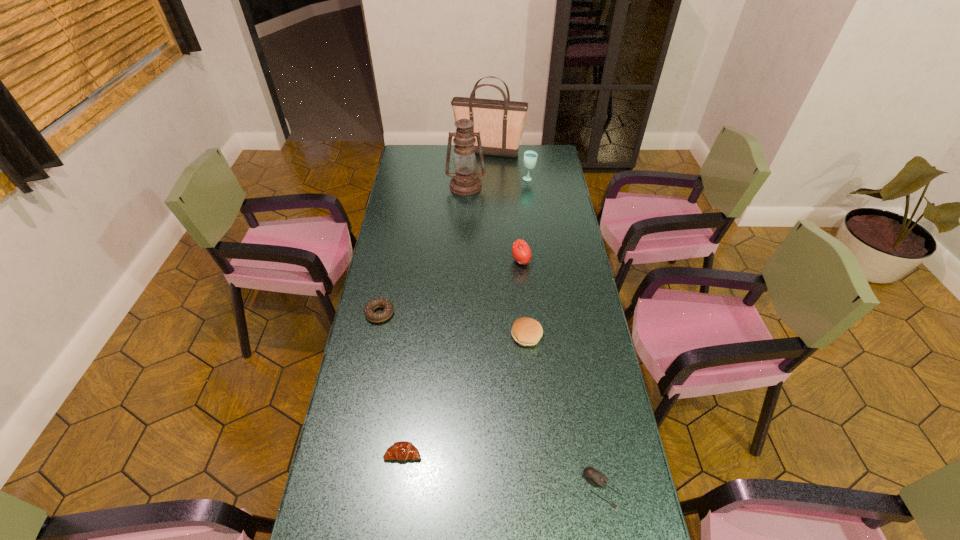
Identify the location of vacant space located on the left of the farthest object. Image resolution: width=960 pixels, height=540 pixels. (427, 152).

I want to click on free space located 0.210m on the left of the oil lamp, so click(403, 186).

I want to click on vacant position located 0.390m on the left of the glass, so click(x=444, y=179).

Find the location of a particular element. This screenshot has width=960, height=540. vacant position located 0.340m on the back of the fourth tallest object is located at coordinates (516, 203).

You are a GUI agent. You are given a task and a screenshot of the screen. Output one action in this format:
    pyautogui.click(x=<x>, y=<y>)
    Task: Click on the free region located on the back of the fourth shortest object
    
    Given the screenshot: What is the action you would take?
    pyautogui.click(x=520, y=268)

Find the location of `free point located 0.270m on the right of the leftmost object`. free point located 0.270m on the right of the leftmost object is located at coordinates (468, 313).

This screenshot has height=540, width=960. What are the coordinates of `blank space located 0.090m on the front of the second nearest object` in the screenshot? It's located at (397, 497).

Where is `free region located on the left of the nearest object`? Image resolution: width=960 pixels, height=540 pixels. free region located on the left of the nearest object is located at coordinates (511, 489).

Locate an element on the screen. This screenshot has height=540, width=960. object that is at the far edge is located at coordinates (501, 123).

You are a GUI agent. You are given a task and a screenshot of the screen. Output one action in this format:
    pyautogui.click(x=<x>, y=<y>)
    Task: Click on the doughnut situated at the left edge
    Image resolution: width=960 pixels, height=540 pixels.
    Given the screenshot: What is the action you would take?
    pyautogui.click(x=387, y=306)